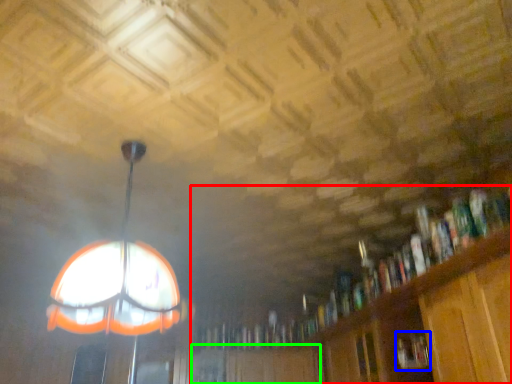
Question: Which object is the farthest from bookcase (highlighted by a red box)? Choose among these: book (highlighted by a blue box) or cabinetry (highlighted by a green box).

Choices:
 (A) book
 (B) cabinetry

Answer: (A)